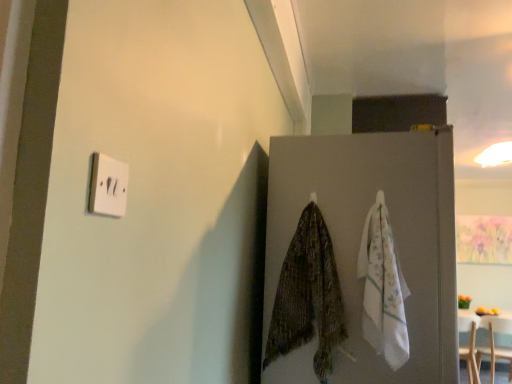
Question: Looking at their shapes, would you say wooden table at lower right is wider or thinner than gray matte refrigerator at center?

Choices:
 (A) thin
 (B) wide

Answer: (A)

Question: In terms of height, does wooden table at lower right look taller or shorter compared to gray matte refrigerator at center?

Choices:
 (A) tall
 (B) short

Answer: (B)

Question: Based on their relative distances, which object is farther from the wooden table at lower right?

Choices:
 (A) textured green scarf at center
 (B) white plastic light switch at upper left
 (C) gray matte refrigerator at center
 (D) white cotton towel at right

Answer: (B)

Question: Estimate the real-world distances between objects in this image. Which object is farther from the wooden table at lower right?

Choices:
 (A) white plastic light switch at upper left
 (B) gray matte refrigerator at center
 (C) white cotton towel at right
 (D) textured green scarf at center

Answer: (A)